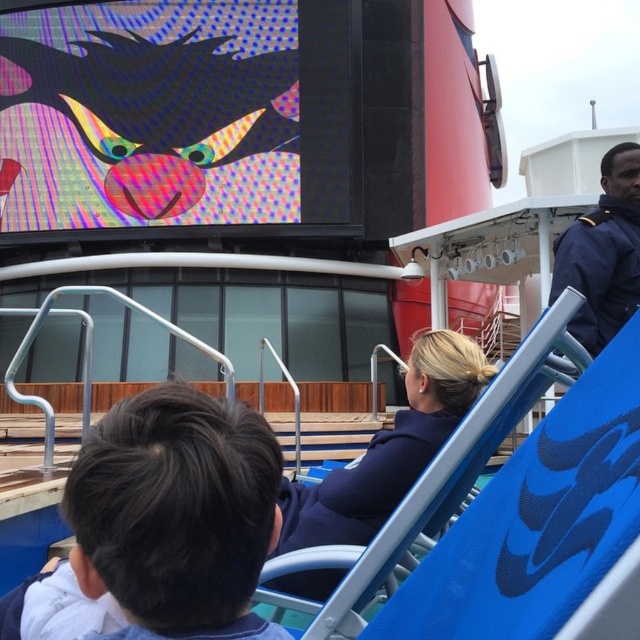
You are standing on the cruise ship deck and want to take a photo of both the point at coordinates (x=166, y=60) and the point at coordinates (x=408, y=442). Which point should you focus on first to ensure both are in focus?

You should focus on the point at coordinates (x=166, y=60) first since it is closer to you than the point at coordinates (x=408, y=442). This ensures both points will be in focus when using depth of field.

You are standing on the cruise ship deck and want to take a photo of the multicolored pixelated screen at upper left. Given that the screen is at coordinates point 0.180, 0.275, can you estimate its position relative to the lounge chairs and the individuals?

The multicolored pixelated screen at upper left is located at point (176, 115), which places it above and to the left of the lounge chairs and the individuals, making it a central focal point in the upper left area of the scene.